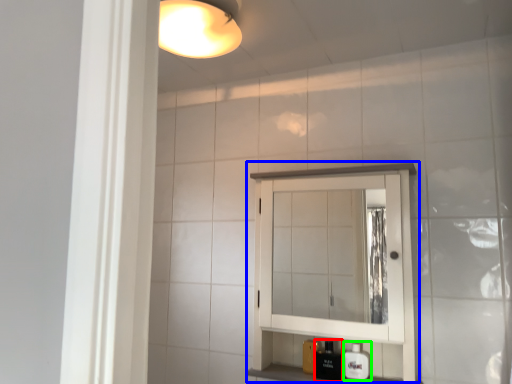
Question: Which is nearer to the toiletry (highlighted by a red box)? medicine cabinet (highlighted by a blue box) or soap dispenser (highlighted by a green box).

Choices:
 (A) medicine cabinet
 (B) soap dispenser

Answer: (B)